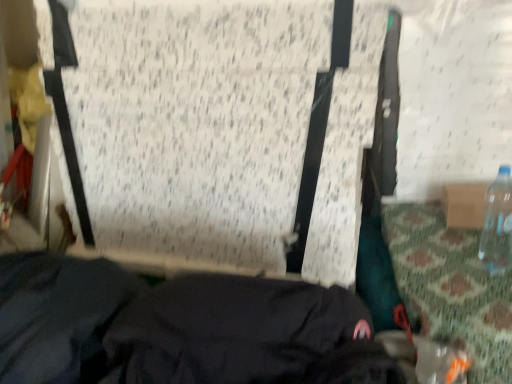
You are a GUI agent. You are given a task and a screenshot of the screen. Output one action in this format:
    pyautogui.click(x=<x>, y=<y>)
    Task: Click on the free space to the left of clear plastic bottle at right
    
    Given the screenshot: What is the action you would take?
    pyautogui.click(x=449, y=268)